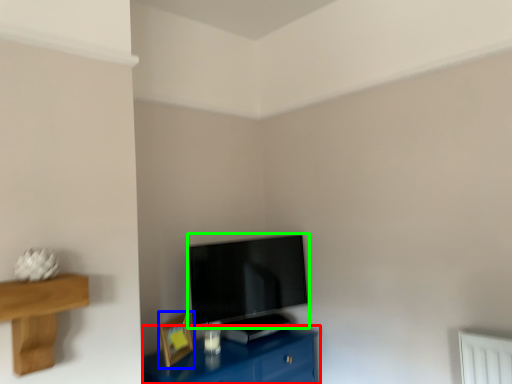
Question: Which object is the farthest from table (highlighted by a red box)? Choose among these: picture frame (highlighted by a blue box) or television (highlighted by a green box).

Choices:
 (A) picture frame
 (B) television

Answer: (B)